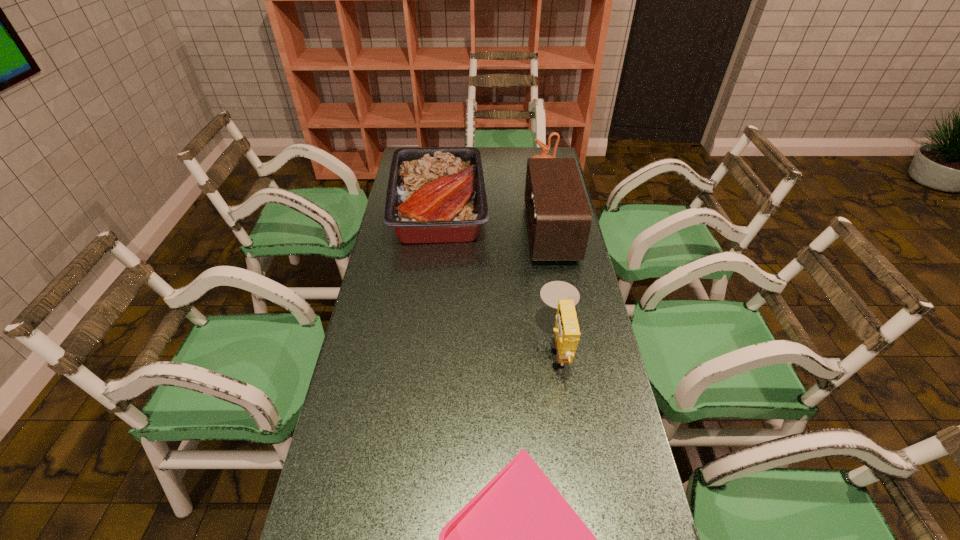
You are a GUI agent. You are given a task and a screenshot of the screen. Output one action in this format:
    pyautogui.click(x=<x>, y=<y>)
    Task: Click on the object located in the far left corner section of the desktop
    The image size is (960, 540).
    Given the screenshot: What is the action you would take?
    pyautogui.click(x=435, y=195)

Find the location of a particular element. object that is at the far right corner is located at coordinates (545, 148).

Find the location of a particular element. The image size is (960, 540). vacant region at the left edge of the desktop is located at coordinates (400, 337).

The width and height of the screenshot is (960, 540). In the image, there is a desktop. In order to click on vacant space at the right edge in this screenshot , I will do `click(602, 397)`.

Where is `vacant point located between the fourth tallest object and the radio receiver`? This screenshot has height=540, width=960. vacant point located between the fourth tallest object and the radio receiver is located at coordinates click(494, 220).

You are a GUI agent. You are given a task and a screenshot of the screen. Output one action in this format:
    pyautogui.click(x=<x>, y=<y>)
    Task: Click on the free point between the fourth tallest object and the fourth farthest object
    The image size is (960, 540).
    Given the screenshot: What is the action you would take?
    pyautogui.click(x=498, y=278)

Identify the location of free space between the sponge and the pottery. (550, 261).

Where is `free area in between the pottery and the tray`? The width and height of the screenshot is (960, 540). free area in between the pottery and the tray is located at coordinates [x=491, y=192].

You are a GUI agent. You are given a task and a screenshot of the screen. Output one action in this format:
    pyautogui.click(x=<x>, y=<y>)
    Task: Click on the object that is the fourth closest to the pottery
    The width and height of the screenshot is (960, 540).
    Given the screenshot: What is the action you would take?
    pyautogui.click(x=518, y=539)

Where is `object identified as the second closest to the nearest object`? The image size is (960, 540). object identified as the second closest to the nearest object is located at coordinates (559, 218).